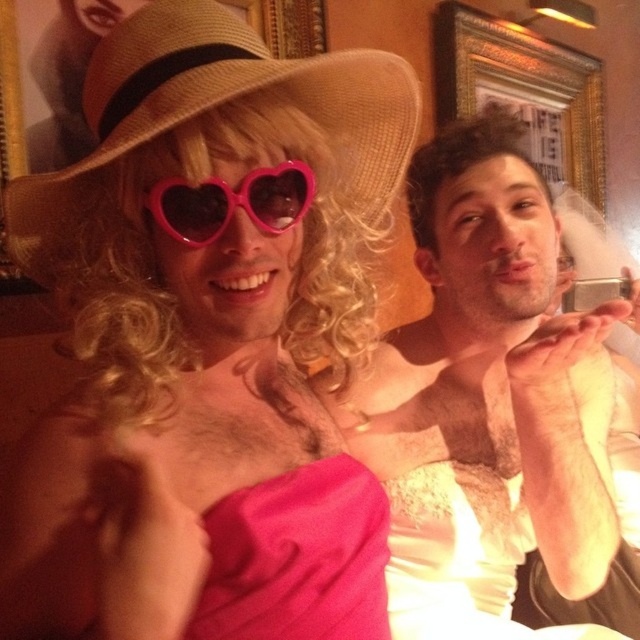
You are a photographer setting up for a photoshoot. You need to position a reflector to bounce light onto the matte white dress at center and the straw hat at left. Based on their positions, where should you place the reflector to ensure both items receive adequate lighting?

The matte white dress at center is located below the straw hat at left, so placing the reflector below the straw hat at left and above the matte white dress at center would direct light to both areas effectively.